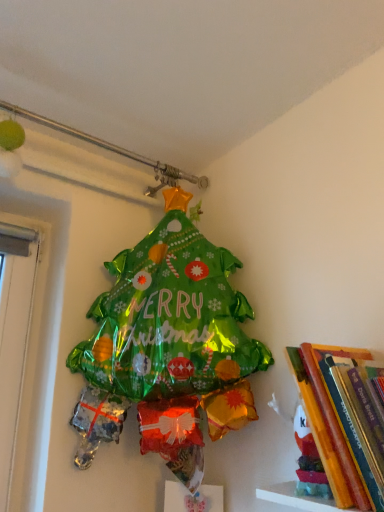
Describe the element at coordinates (344, 420) in the screenshot. The image size is (384, 512). I see `hardcover book at upper right` at that location.

Locate an element on the screen. The height and width of the screenshot is (512, 384). hardcover book at upper right is located at coordinates (344, 420).

This screenshot has height=512, width=384. I want to click on hardcover book at upper right, so click(344, 420).